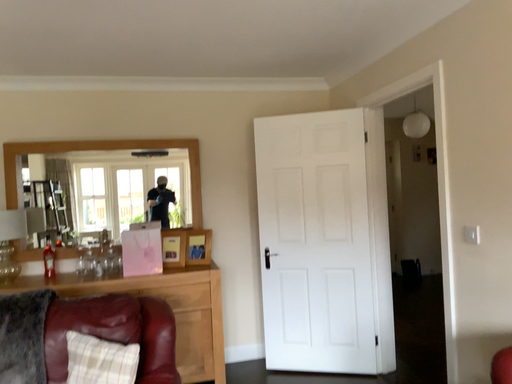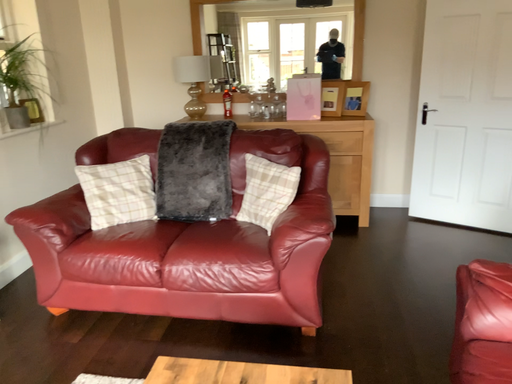
Question: Which way did the camera rotate in the video?

Choices:
 (A) rotated downward
 (B) rotated upward

Answer: (A)